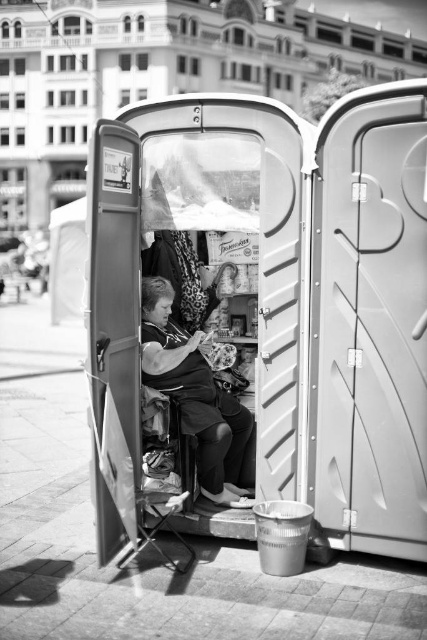
Question: Which of the following is the farthest from the observer?

Choices:
 (A) (321, 308)
 (B) (143, 280)

Answer: (B)

Question: Which point appears closest to the camera in this image?

Choices:
 (A) (187, 419)
 (B) (274, 413)

Answer: (B)

Question: Which of the following is the closest to the observer?

Choices:
 (A) matte black fabric woman at center
 (B) plastic portable toilet at center

Answer: (B)

Question: Does plastic portable toilet at center have a larger size compared to matte black fabric woman at center?

Choices:
 (A) yes
 (B) no

Answer: (A)

Question: Is plastic portable toilet at center positioned in front of matte black fabric woman at center?

Choices:
 (A) no
 (B) yes

Answer: (B)

Question: Does plastic portable toilet at center have a larger size compared to matte black fabric woman at center?

Choices:
 (A) yes
 (B) no

Answer: (A)